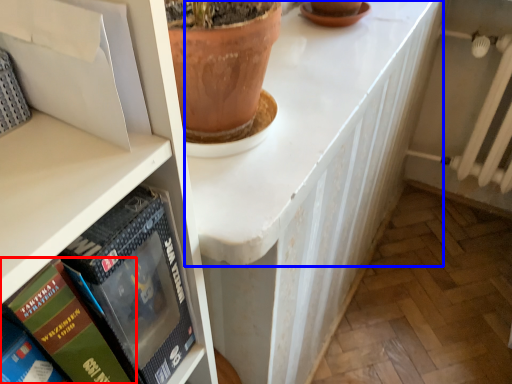
Question: Among these objects, which one is farthest to the camera, book (highlighted by a red box) or counter top (highlighted by a blue box)?

Choices:
 (A) book
 (B) counter top

Answer: (B)